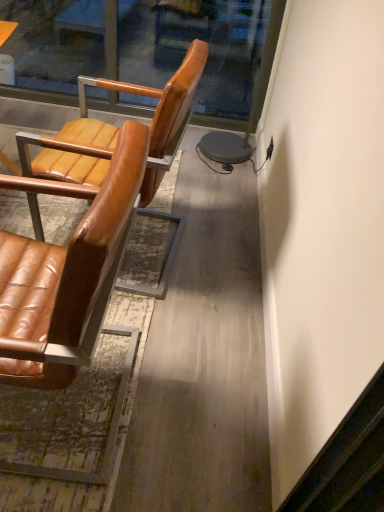
Question: Should I look upward or downward to see brown leather chair at left, which appears as the first chair when viewed from the back?

Choices:
 (A) up
 (B) down

Answer: (A)

Question: From the image's perspective, does brown leather chair at left, placed as the second chair when sorted from front to back, appear higher than transparent glass door at upper center?

Choices:
 (A) yes
 (B) no

Answer: (B)

Question: Does brown leather chair at left, placed as the second chair when sorted from front to back, lie in front of transparent glass door at upper center?

Choices:
 (A) yes
 (B) no

Answer: (A)

Question: Can you see brown leather chair at left, placed as the second chair when sorted from front to back, touching transparent glass door at upper center?

Choices:
 (A) yes
 (B) no

Answer: (B)

Question: Is brown leather chair at left, placed as the second chair when sorted from front to back, outside of transparent glass door at upper center?

Choices:
 (A) no
 (B) yes

Answer: (B)

Question: Is brown leather chair at left, which appears as the first chair when viewed from the back, not near transparent glass door at upper center?

Choices:
 (A) no
 (B) yes

Answer: (B)

Question: From the image's perspective, is brown leather chair at left, placed as the second chair when sorted from front to back, located beneath transparent glass door at upper center?

Choices:
 (A) yes
 (B) no

Answer: (A)

Question: Can you confirm if brown leather chair at left, placed as the second chair when sorted from front to back, is bigger than brown leather chair at left, the 1th chair positioned from the front?

Choices:
 (A) yes
 (B) no

Answer: (B)

Question: Can you confirm if brown leather chair at left, which appears as the first chair when viewed from the back, is positioned to the left of brown leather chair at left, arranged as the 2th chair when viewed from the back?

Choices:
 (A) no
 (B) yes

Answer: (A)

Question: Is brown leather chair at left, which appears as the first chair when viewed from the back, looking in the opposite direction of brown leather chair at left, the 1th chair positioned from the front?

Choices:
 (A) yes
 (B) no

Answer: (B)

Question: Is brown leather chair at left, placed as the second chair when sorted from front to back, thinner than brown leather chair at left, arranged as the 2th chair when viewed from the back?

Choices:
 (A) no
 (B) yes

Answer: (A)

Question: From the image's perspective, is brown leather chair at left, which appears as the first chair when viewed from the back, below brown leather chair at left, the 1th chair positioned from the front?

Choices:
 (A) no
 (B) yes

Answer: (A)

Question: Is brown leather chair at left, which appears as the first chair when viewed from the back, not inside brown leather chair at left, arranged as the 2th chair when viewed from the back?

Choices:
 (A) no
 (B) yes

Answer: (B)

Question: Considering the relative positions of brown leather chair at left, the 1th chair positioned from the front, and brown leather chair at left, placed as the second chair when sorted from front to back, in the image provided, is brown leather chair at left, the 1th chair positioned from the front, behind brown leather chair at left, placed as the second chair when sorted from front to back,?

Choices:
 (A) yes
 (B) no

Answer: (B)